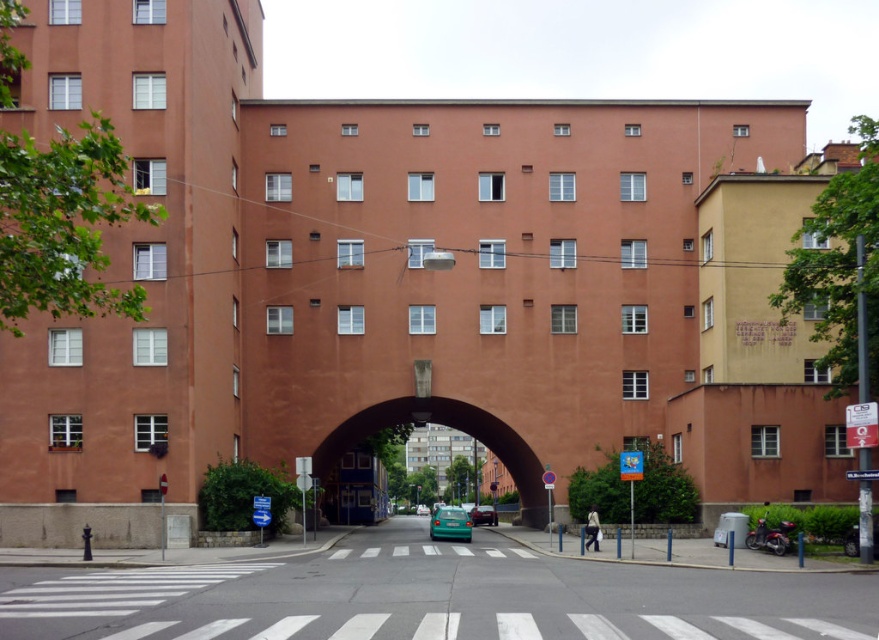
Question: Among these objects, which one is farthest from the camera?

Choices:
 (A) teal glossy car at center
 (B) brown concrete archway at center

Answer: (A)

Question: In this image, where is brown concrete archway at center located relative to green matte car at center?

Choices:
 (A) right
 (B) left

Answer: (A)

Question: Which point appears closest to the camera in this image?

Choices:
 (A) (383, 422)
 (B) (416, 509)

Answer: (A)

Question: Where is teal matte car at center located in relation to teal glossy car at center in the image?

Choices:
 (A) right
 (B) left

Answer: (A)

Question: From the image, what is the correct spatial relationship of brown concrete archway at center in relation to green matte car at center?

Choices:
 (A) above
 (B) below

Answer: (A)

Question: Among these objects, which one is nearest to the camera?

Choices:
 (A) green matte car at center
 (B) teal glossy car at center

Answer: (A)